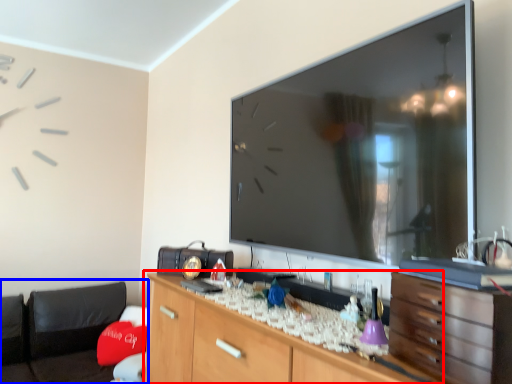
Question: Which point is further to the camera, cabinetry (highlighted by a red box) or bean bag chair (highlighted by a blue box)?

Choices:
 (A) cabinetry
 (B) bean bag chair

Answer: (B)